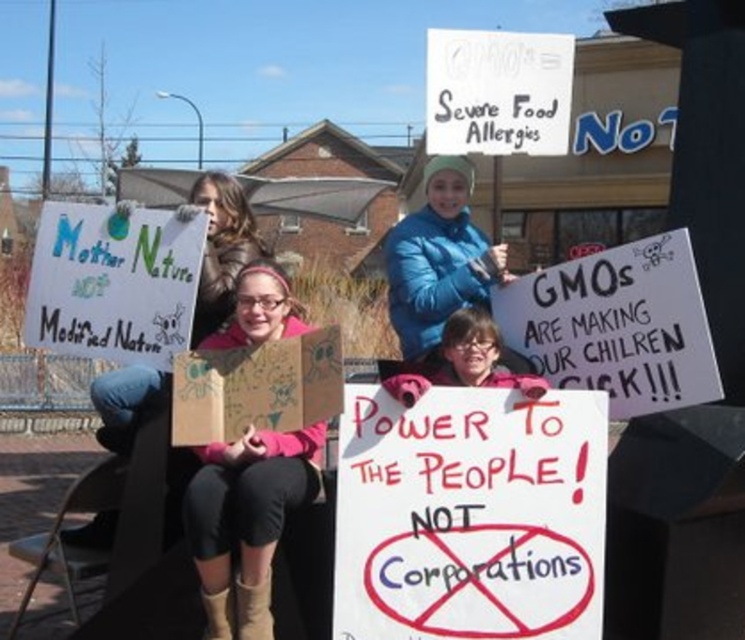
You are a photographer at the protest. You want to take a photo of the pink fabric shirt at center without the white cardboard sign at center blocking it. How should you adjust your position?

The pink fabric shirt at center is behind the white cardboard sign at center, so to avoid the sign blocking the shirt, you should move to a position where the shirt is visible around or beyond the sign, perhaps by moving to the side or slightly behind the sign.